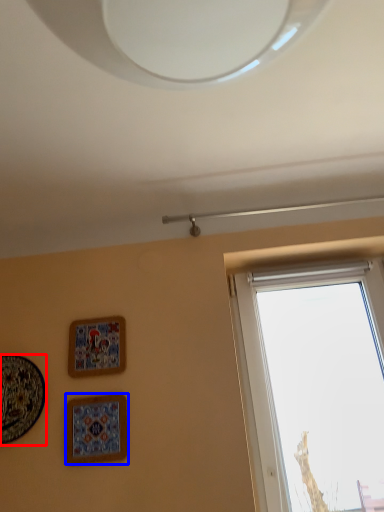
Question: Which of the following is the closest to the observer, picture frame (highlighted by a red box) or picture frame (highlighted by a blue box)?

Choices:
 (A) picture frame
 (B) picture frame

Answer: (B)